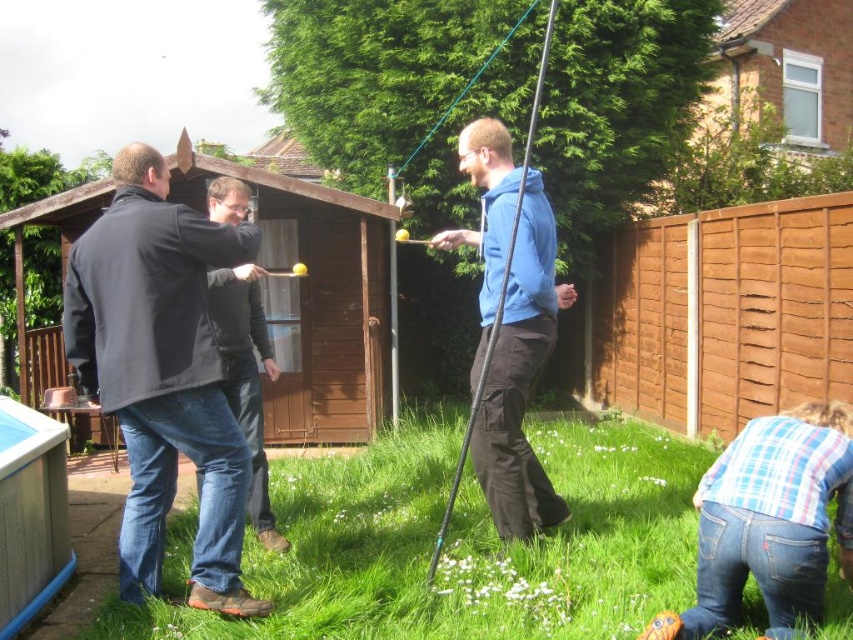
Who is lower down, green grass at lower center or dark blue jacket at left?

green grass at lower center is below.

Can you confirm if green grass at lower center is positioned above dark blue jacket at left?

No, green grass at lower center is not above dark blue jacket at left.

Locate an element on the screen. The height and width of the screenshot is (640, 853). green grass at lower center is located at coordinates (456, 547).

This screenshot has height=640, width=853. Identify the location of green grass at lower center. (456, 547).

Describe the element at coordinates (456, 547) in the screenshot. This screenshot has width=853, height=640. I see `green grass at lower center` at that location.

Which is behind, point (844, 588) or point (229, 198)?

The point (229, 198) is more distant.

This screenshot has width=853, height=640. Describe the element at coordinates (456, 547) in the screenshot. I see `green grass at lower center` at that location.

Find the location of a particular element. The height and width of the screenshot is (640, 853). green grass at lower center is located at coordinates (456, 547).

Which is in front, point (509, 346) or point (222, 179)?

Positioned in front is point (509, 346).

Based on the photo, who is more distant from viewer, (538, 348) or (241, 403)?

The point (241, 403) is more distant.

Which is behind, point (508, 467) or point (262, 504)?

Point (262, 504)

You are a GUI agent. You are given a task and a screenshot of the screen. Output one action in this format:
    pyautogui.click(x=<x>, y=<y>)
    Task: Click on the blue fleece jacket at center
    The height and width of the screenshot is (640, 853).
    Given the screenshot: What is the action you would take?
    coord(508,330)